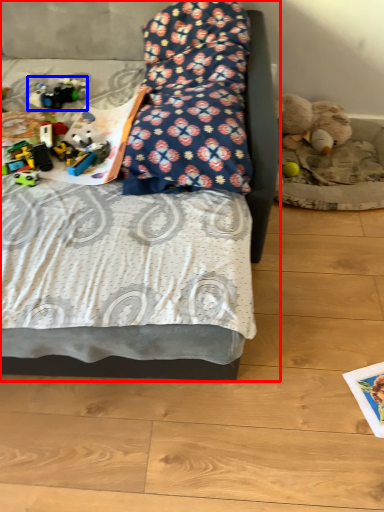
Question: Among these objects, which one is nearest to the camera, bed (highlighted by a red box) or toy (highlighted by a blue box)?

Choices:
 (A) bed
 (B) toy

Answer: (A)